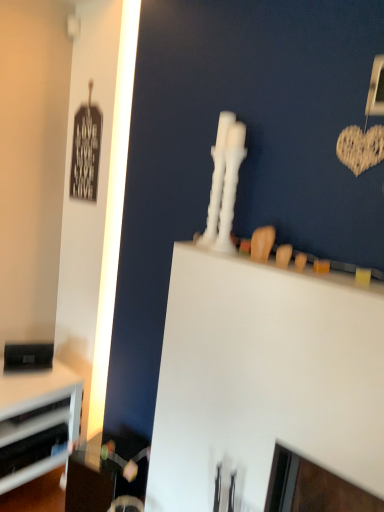
Question: From the image's perspective, is brushed metal drawer at lower left, positioned as the second drawer in bottom-to-top order, located beneath black matte speaker at lower left?

Choices:
 (A) no
 (B) yes

Answer: (B)

Question: Is brushed metal drawer at lower left, the 1th drawer in the top-to-bottom sequence, outside of black matte speaker at lower left?

Choices:
 (A) no
 (B) yes

Answer: (B)

Question: Considering the relative sizes of brushed metal drawer at lower left, positioned as the second drawer in bottom-to-top order, and black matte speaker at lower left in the image provided, is brushed metal drawer at lower left, positioned as the second drawer in bottom-to-top order, bigger than black matte speaker at lower left?

Choices:
 (A) no
 (B) yes

Answer: (A)

Question: From the image's perspective, is brushed metal drawer at lower left, the 1th drawer in the top-to-bottom sequence, on black matte speaker at lower left?

Choices:
 (A) no
 (B) yes

Answer: (A)

Question: From a real-world perspective, is brushed metal drawer at lower left, positioned as the second drawer in bottom-to-top order, located beneath black matte speaker at lower left?

Choices:
 (A) no
 (B) yes

Answer: (B)

Question: Is black matte speaker at lower left bigger or smaller than brushed metal drawer at lower left, positioned as the second drawer in bottom-to-top order?

Choices:
 (A) big
 (B) small

Answer: (A)

Question: From their relative heights in the image, would you say black matte speaker at lower left is taller or shorter than brushed metal drawer at lower left, the 1th drawer in the top-to-bottom sequence?

Choices:
 (A) tall
 (B) short

Answer: (A)

Question: Relative to brushed metal drawer at lower left, positioned as the second drawer in bottom-to-top order, is black matte speaker at lower left in front or behind?

Choices:
 (A) behind
 (B) front

Answer: (A)

Question: Based on their positions, is black matte speaker at lower left located to the left or right of brushed metal drawer at lower left, positioned as the second drawer in bottom-to-top order?

Choices:
 (A) right
 (B) left

Answer: (B)

Question: Relative to white matte computer desk at upper center, is brushed metal drawer at lower left, the 1th drawer in the top-to-bottom sequence, in front or behind?

Choices:
 (A) behind
 (B) front

Answer: (A)

Question: From a real-world perspective, is brushed metal drawer at lower left, positioned as the second drawer in bottom-to-top order, positioned above or below white matte computer desk at upper center?

Choices:
 (A) above
 (B) below

Answer: (B)

Question: In terms of height, does brushed metal drawer at lower left, the 1th drawer in the top-to-bottom sequence, look taller or shorter compared to white matte computer desk at upper center?

Choices:
 (A) tall
 (B) short

Answer: (B)

Question: Does point (1, 424) appear closer or farther from the camera than point (200, 265)?

Choices:
 (A) farther
 (B) closer

Answer: (A)

Question: Is black matte speaker at lower left to the left or to the right of white plastic drawer at lower left, positioned as the first drawer in bottom-to-top order, in the image?

Choices:
 (A) left
 (B) right

Answer: (A)

Question: In the image, is black matte speaker at lower left positioned in front of or behind white plastic drawer at lower left, the 2th drawer positioned from the top?

Choices:
 (A) behind
 (B) front

Answer: (A)